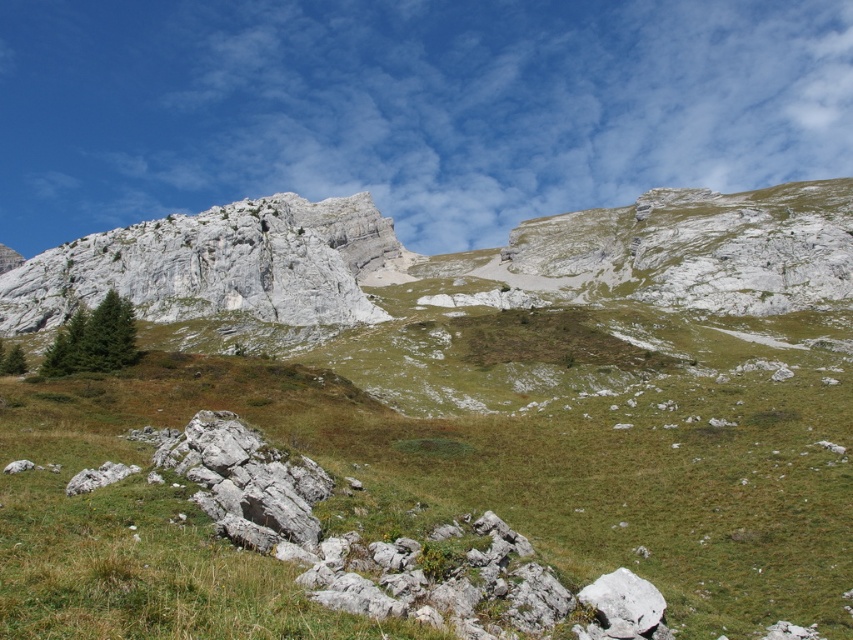
Who is positioned more to the right, green grassy at center or gray rock formation at upper left?

Positioned to the right is green grassy at center.

Is green grassy at center thinner than gray rock formation at upper left?

Correct, green grassy at center's width is less than gray rock formation at upper left's.

Who is more forward, (86, 461) or (198, 260)?

Point (86, 461) is in front.

Where is `green grassy at center`? green grassy at center is located at coordinates (430, 497).